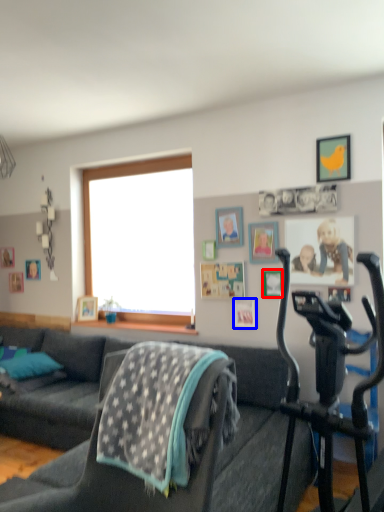
Question: Which object is closer to the camera taking this photo, picture frame (highlighted by a red box) or picture frame (highlighted by a blue box)?

Choices:
 (A) picture frame
 (B) picture frame

Answer: (A)